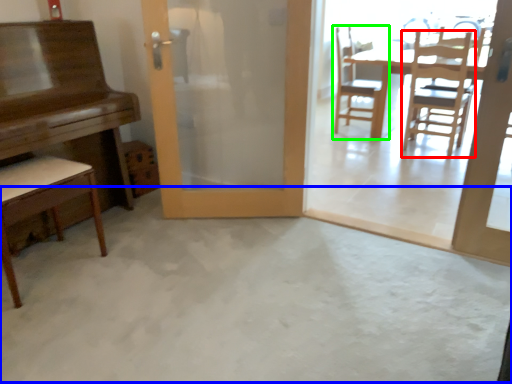
Question: Which is farther away from chair (highlighted by a red box)? concrete (highlighted by a blue box) or chair (highlighted by a green box)?

Choices:
 (A) concrete
 (B) chair

Answer: (A)